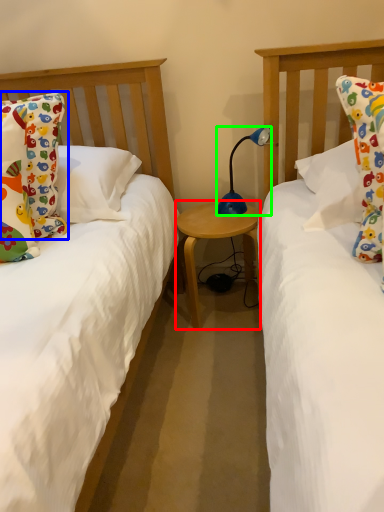
Question: Considering the real-world distances, which object is farthest from table (highlighted by a red box)? pillow (highlighted by a blue box) or lamp (highlighted by a green box)?

Choices:
 (A) pillow
 (B) lamp

Answer: (A)